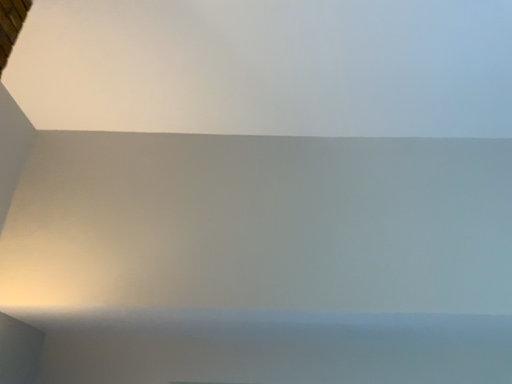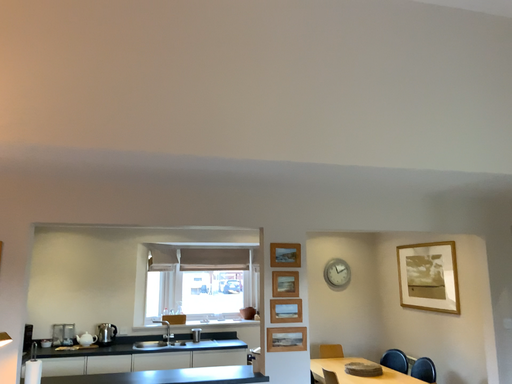
Question: How did the camera likely rotate when shooting the video?

Choices:
 (A) rotated right
 (B) rotated left

Answer: (A)